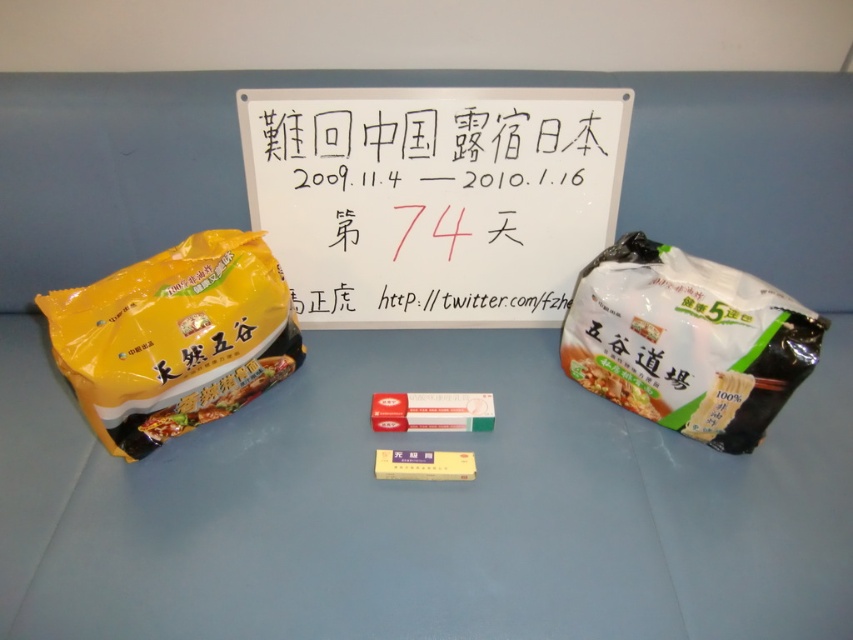
Question: Estimate the real-world distances between objects in this image. Which object is farther from the yellow matte instant noodles at left?

Choices:
 (A) blue matte table at center
 (B) white paperboard at center

Answer: (B)

Question: Among these objects, which one is farthest from the camera?

Choices:
 (A) blue matte table at center
 (B) yellow matte instant noodles at left
 (C) white paperboard at center

Answer: (C)

Question: Which of these objects is positioned closest to the white matte instant noodle at right?

Choices:
 (A) white paperboard at center
 (B) yellow matte instant noodles at left

Answer: (A)

Question: Can you confirm if yellow matte instant noodles at left is bigger than white matte instant noodle at right?

Choices:
 (A) no
 (B) yes

Answer: (A)

Question: Observing the image, what is the correct spatial positioning of white paperboard at center in reference to yellow matte instant noodles at left?

Choices:
 (A) below
 (B) above

Answer: (B)

Question: Can you confirm if white paperboard at center is thinner than yellow matte instant noodles at left?

Choices:
 (A) yes
 (B) no

Answer: (B)